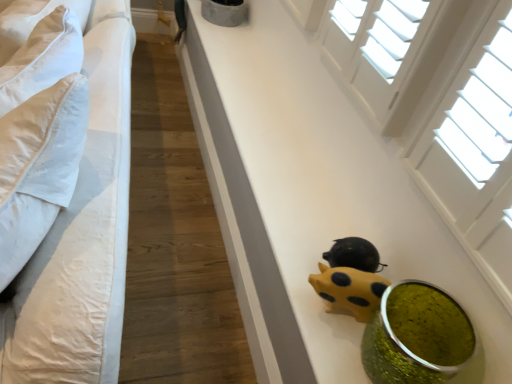
Locate an element on the screen. unoccupied space behind yellow matte piggy bank at lower center is located at coordinates (315, 234).